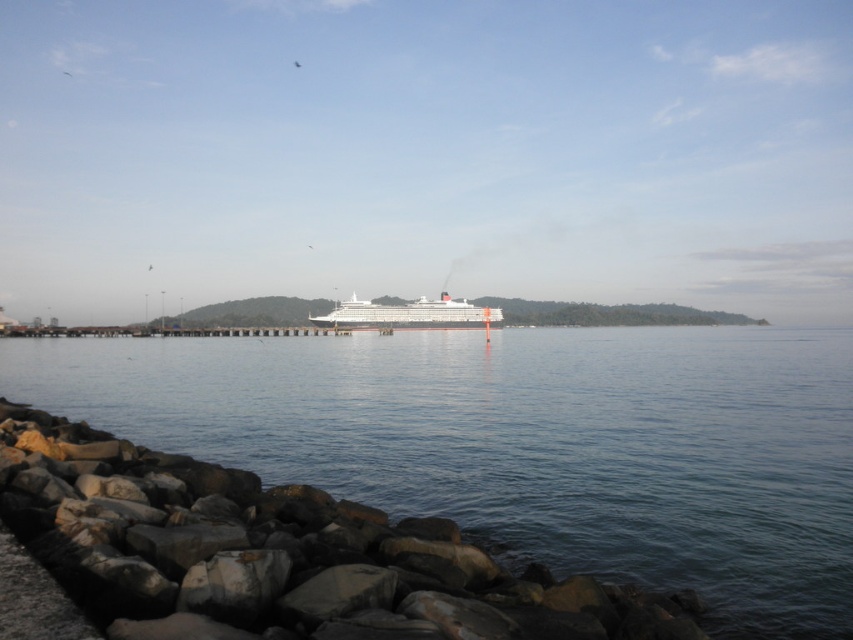
You are a photographer planning to capture the white glossy cruise ship at center and the clear blue water at lower center. Based on the scene, which of these two elements occupies a larger area in the image?

The clear blue water at lower center occupies a larger area in the image as its width is greater than that of the white glossy cruise ship at center.